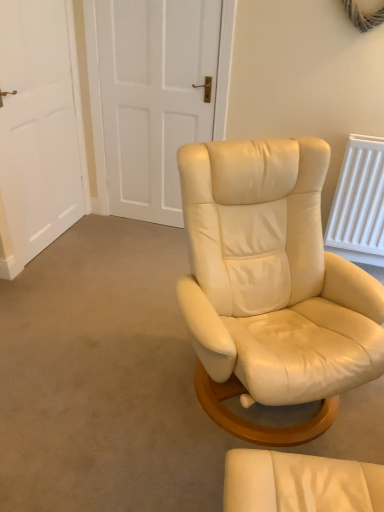
Question: Can you confirm if white matte door at upper center, the first door positioned from the right, is thinner than matte cream leather chair at center?

Choices:
 (A) no
 (B) yes

Answer: (B)

Question: Does white matte door at upper center, acting as the 2th door starting from the left, appear on the left side of matte cream leather chair at center?

Choices:
 (A) yes
 (B) no

Answer: (A)

Question: Is white matte door at upper center, acting as the 2th door starting from the left, oriented towards matte cream leather chair at center?

Choices:
 (A) yes
 (B) no

Answer: (B)

Question: Is white matte door at upper center, acting as the 2th door starting from the left, surrounding matte cream leather chair at center?

Choices:
 (A) no
 (B) yes

Answer: (A)

Question: From a real-world perspective, is white matte door at upper center, acting as the 2th door starting from the left, under matte cream leather chair at center?

Choices:
 (A) yes
 (B) no

Answer: (B)

Question: Based on their sizes in the image, would you say white matte door at upper left, which is counted as the 1th door, starting from the left, is bigger or smaller than matte cream leather chair at center?

Choices:
 (A) small
 (B) big

Answer: (B)

Question: Is white matte door at upper left, acting as the second door starting from the right, wider or thinner than matte cream leather chair at center?

Choices:
 (A) thin
 (B) wide

Answer: (A)

Question: Is white matte door at upper left, acting as the second door starting from the right, inside the boundaries of matte cream leather chair at center, or outside?

Choices:
 (A) outside
 (B) inside

Answer: (A)

Question: From the image's perspective, is white matte door at upper left, acting as the second door starting from the right, located above or below matte cream leather chair at center?

Choices:
 (A) below
 (B) above

Answer: (B)

Question: Looking at their shapes, would you say white matte door at upper left, acting as the second door starting from the right, is wider or thinner than white matte door at upper center, the first door positioned from the right?

Choices:
 (A) wide
 (B) thin

Answer: (B)

Question: Considering the positions of point coord(31,158) and point coord(150,99), is point coord(31,158) closer or farther from the camera than point coord(150,99)?

Choices:
 (A) farther
 (B) closer

Answer: (B)

Question: From the image's perspective, is white matte door at upper left, which is counted as the 1th door, starting from the left, above or below white matte door at upper center, acting as the 2th door starting from the left?

Choices:
 (A) below
 (B) above

Answer: (A)

Question: Considering their positions, is white matte door at upper left, which is counted as the 1th door, starting from the left, located in front of or behind white matte door at upper center, the first door positioned from the right?

Choices:
 (A) front
 (B) behind

Answer: (A)

Question: Considering the positions of matte cream leather chair at center and white matte door at upper center, acting as the 2th door starting from the left, in the image, is matte cream leather chair at center bigger or smaller than white matte door at upper center, acting as the 2th door starting from the left,?

Choices:
 (A) small
 (B) big

Answer: (A)

Question: Relative to white matte door at upper center, the first door positioned from the right, is matte cream leather chair at center in front or behind?

Choices:
 (A) behind
 (B) front

Answer: (B)